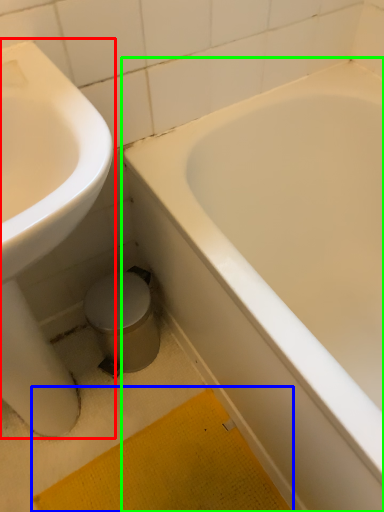
Question: Based on their relative distances, which object is nearer to sink (highlighted by a red box)? Choose from bath mat (highlighted by a blue box) and bathtub (highlighted by a green box).

Choices:
 (A) bath mat
 (B) bathtub

Answer: (A)